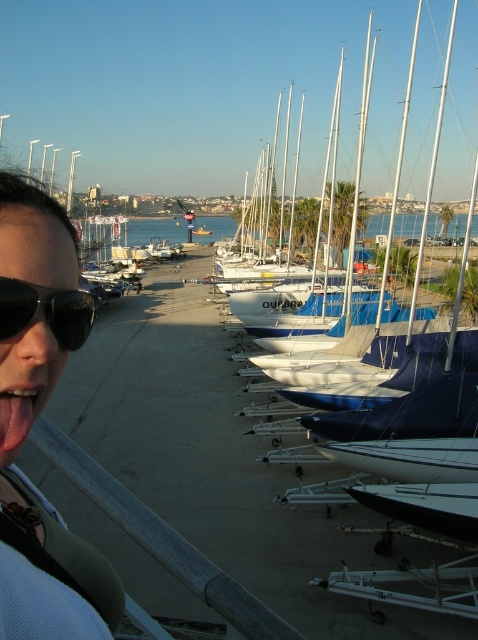
Does white matte boat at center have a lesser height compared to pink glossy tongue at lower left?

In fact, white matte boat at center may be taller than pink glossy tongue at lower left.

Is point (401, 497) farther from camera compared to point (3, 445)?

Yes.

At what (x,y) coordinates should I click in order to perform the action: click on white matte boat at center. Please return your answer as a coordinate pair (x, y). Looking at the image, I should click on (424, 506).

Is white matte boat at center positioned in front of black reflective sunglasses at lower left?

No, it is not.

Which is above, white matte boat at center or black reflective sunglasses at lower left?

Positioned higher is black reflective sunglasses at lower left.

Locate an element on the screen. The height and width of the screenshot is (640, 478). white matte boat at center is located at coordinates (424, 506).

Between black reflective sunglasses at lower left and white matte sailboat at center, which one appears on the left side from the viewer's perspective?

white matte sailboat at center

Which is behind, point (56, 333) or point (197, 228)?

Point (197, 228)

Does point (63, 348) come in front of point (204, 228)?

Yes, it is in front of point (204, 228).

In order to click on black reflective sunglasses at lower left in this screenshot , I will do `click(45, 310)`.